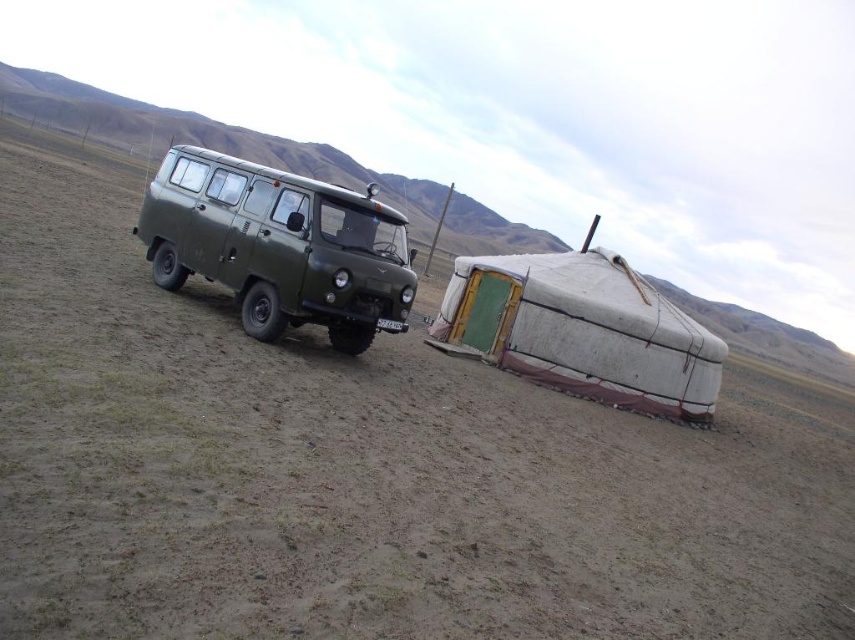
You are planning to transport both the olive green matte van at center and the white canvas tent at lower right to a new location. Which object would require a larger vehicle for transportation due to its size?

The olive green matte van at center requires a larger vehicle for transportation because it has a larger size compared to the white canvas tent at lower right.

You are a traveler who wants to set up a tent near the olive green matte van at center and the white canvas tent at lower right. Which object is located to the right side of the other?

The olive green matte van at center is to the left of the white canvas tent at lower right, so the white canvas tent at lower right is located to the right side of the olive green matte van at center.